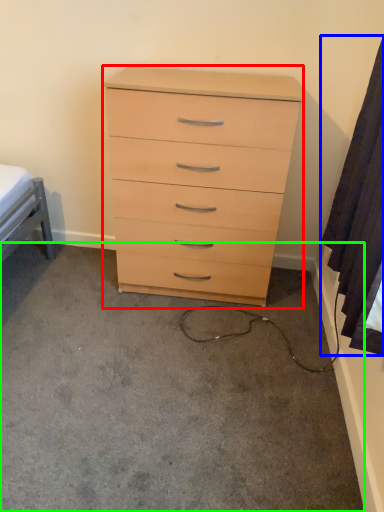
Question: Considering the real-world distances, which object is farthest from chest of drawers (highlighted by a red box)? curtain (highlighted by a blue box) or concrete (highlighted by a green box)?

Choices:
 (A) curtain
 (B) concrete

Answer: (B)